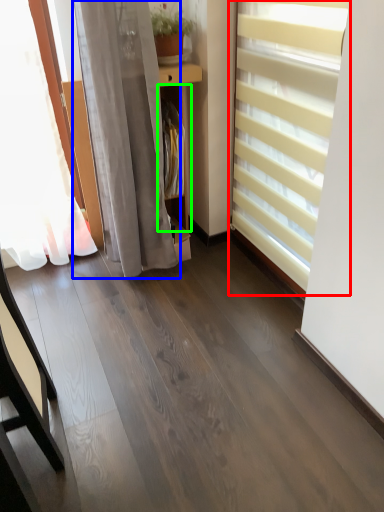
Question: Which object is positioned closest to window blind (highlighted by a red box)? Select from curtain (highlighted by a blue box) and shelf (highlighted by a green box).

Choices:
 (A) curtain
 (B) shelf

Answer: (B)